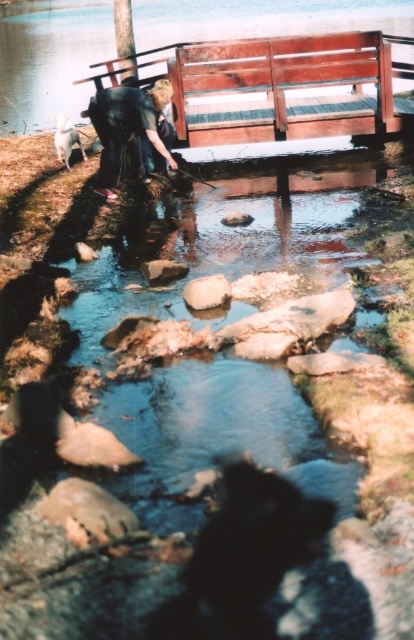
Question: Which object is farther from the camera taking this photo?

Choices:
 (A) white smooth rock at center
 (B) wooden bench at upper center
 (C) smooth wooden bench at upper center

Answer: (C)

Question: Is wooden bench at upper center positioned before white smooth rock at center?

Choices:
 (A) no
 (B) yes

Answer: (A)

Question: Does wooden bench at upper center appear under dark blue fabric at center?

Choices:
 (A) no
 (B) yes

Answer: (A)

Question: Which of the following is the farthest from the observer?

Choices:
 (A) (149, 109)
 (B) (89, 51)
 (C) (226, 45)

Answer: (B)

Question: Which point is closer to the camera?

Choices:
 (A) (221, 276)
 (B) (322, 17)

Answer: (A)

Question: Can you confirm if smooth wooden bench at upper center is thinner than white smooth rock at center?

Choices:
 (A) no
 (B) yes

Answer: (A)